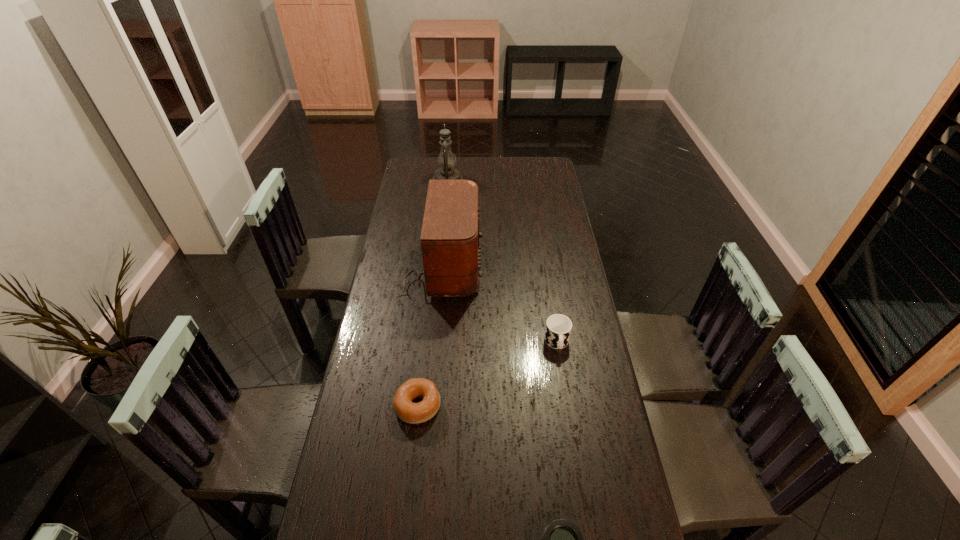
Locate an element on the screen. free space located 0.400m on the front-facing side of the smallest yellow sunflower is located at coordinates (454, 226).

Image resolution: width=960 pixels, height=540 pixels. Identify the location of vacant space situated on the face of the nearest sunflower. (595, 497).

Image resolution: width=960 pixels, height=540 pixels. Find the location of `fire extinguisher that is at the far edge`. fire extinguisher that is at the far edge is located at coordinates (491, 103).

You are a GUI agent. You are given a task and a screenshot of the screen. Output one action in this format:
    pyautogui.click(x=<x>, y=<y>)
    Task: Click on the sunflower located in the far edge section of the desktop
    The width and height of the screenshot is (960, 540).
    Given the screenshot: What is the action you would take?
    pyautogui.click(x=425, y=157)

Locate an element on the screen. The width and height of the screenshot is (960, 540). carton present at the far edge is located at coordinates point(550,131).

The height and width of the screenshot is (540, 960). I want to click on object that is at the left edge, so click(x=425, y=157).

Locate an element on the screen. carton at the right edge is located at coordinates (550, 131).

You are a GUI agent. You are given a task and a screenshot of the screen. Output one action in this format:
    pyautogui.click(x=<x>, y=<y>)
    Task: Click on the object that is at the far left corner
    The width and height of the screenshot is (960, 540).
    Given the screenshot: What is the action you would take?
    pyautogui.click(x=425, y=157)

Locate an element on the screen. object at the far right corner is located at coordinates (550, 131).

In the image, there is a desktop. Find the location of `vacant space at the far edge`. vacant space at the far edge is located at coordinates (441, 152).